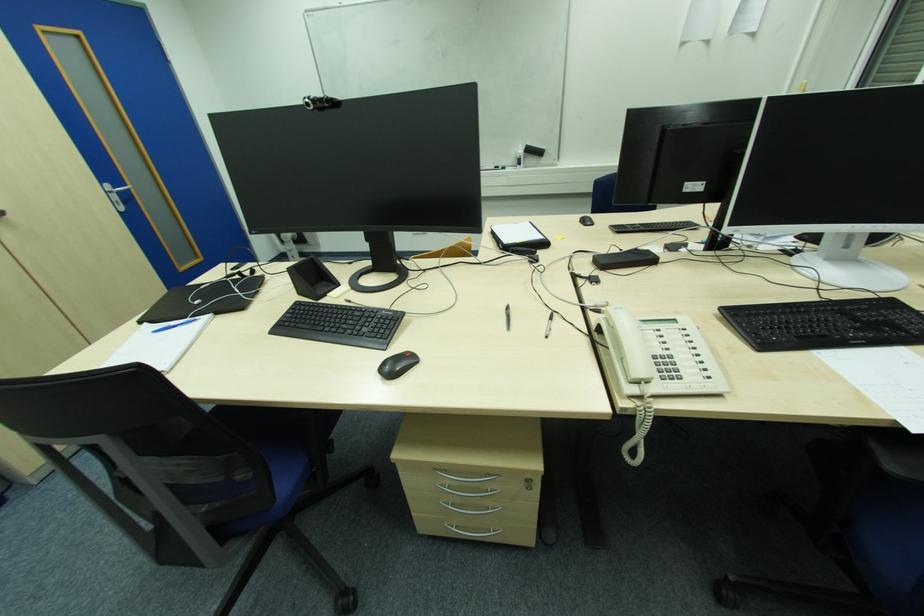
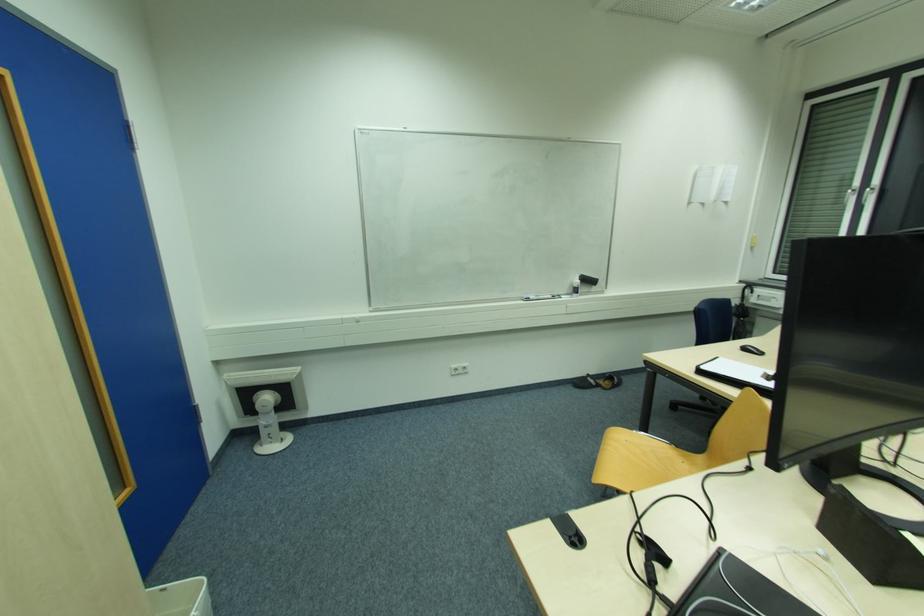
Where in the second image is the point corresponding to the point at 521,153 from the first image?

(578, 282)